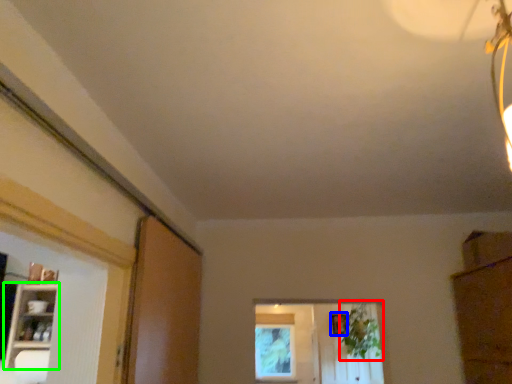
Question: Based on their relative distances, which object is farther from plant (highlighted by a red box)? Choose from picture frame (highlighted by a blue box) and shelf (highlighted by a green box).

Choices:
 (A) picture frame
 (B) shelf

Answer: (B)